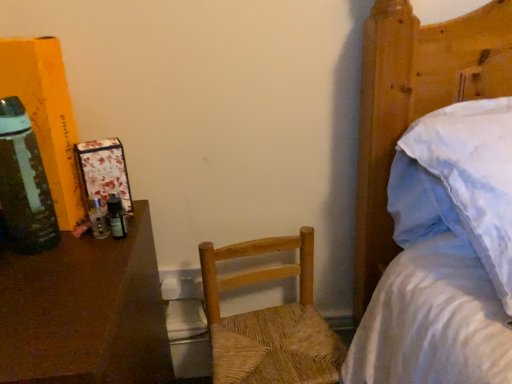
Image resolution: width=512 pixels, height=384 pixels. Identify the location of free point in front of green glass bottle at left. pos(41,296).